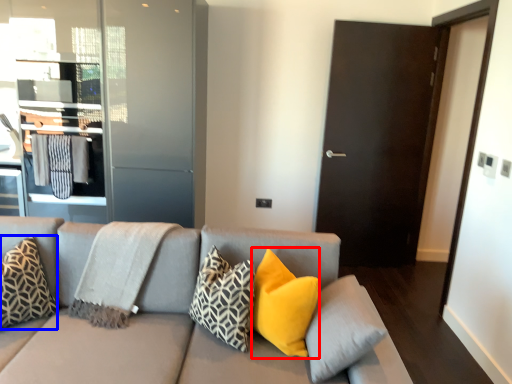
Question: Which object appears closest to the camera in this image, pillow (highlighted by a red box) or pillow (highlighted by a blue box)?

Choices:
 (A) pillow
 (B) pillow

Answer: (A)